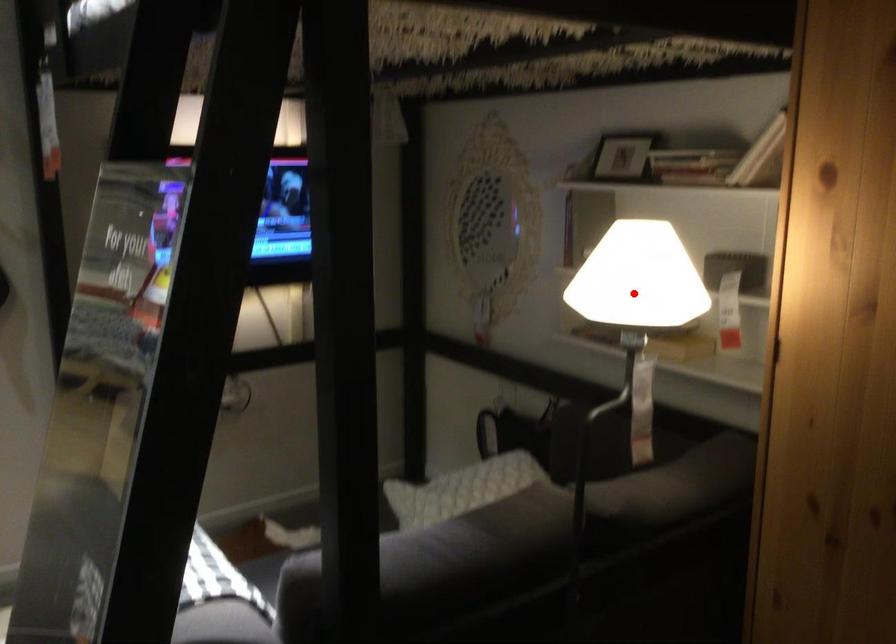
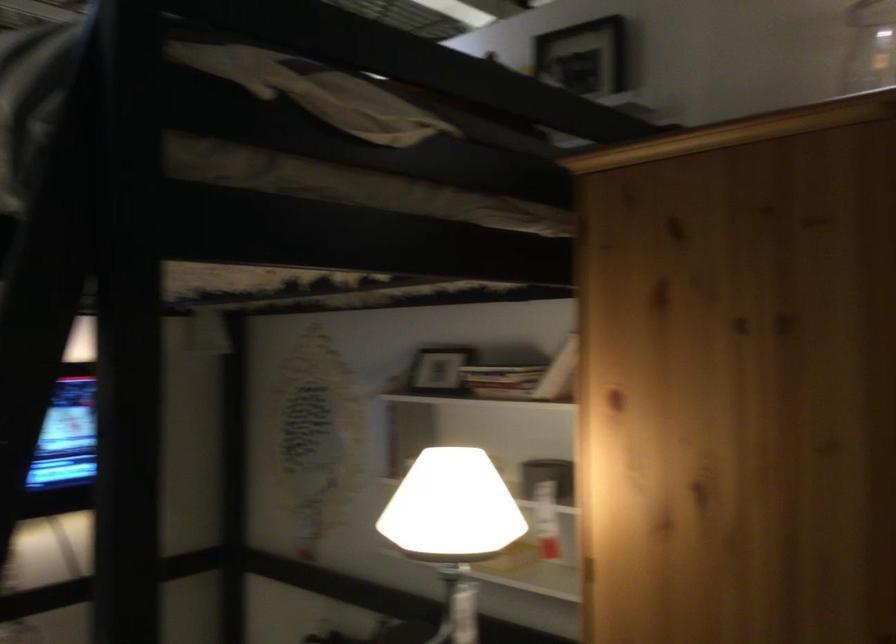
In the second image, find the point that corresponds to the highlighted location in the first image.

(452, 525)